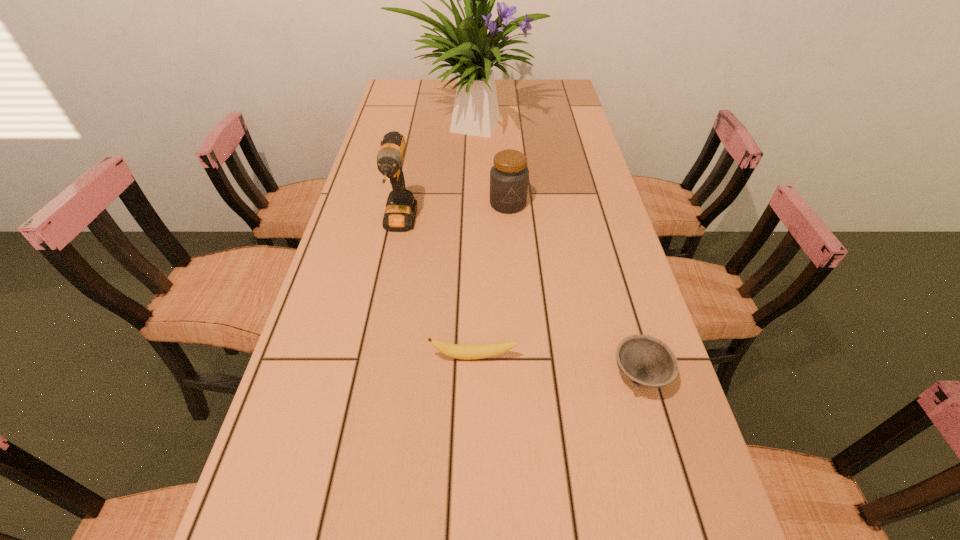
This screenshot has width=960, height=540. Identify the location of the tallest object. (471, 52).

Image resolution: width=960 pixels, height=540 pixels. I want to click on the farthest object, so (471, 52).

Find the location of a particular element. The height and width of the screenshot is (540, 960). drill is located at coordinates (401, 207).

Identify the location of the third shortest object. This screenshot has height=540, width=960. (509, 176).

Identify the location of banana. This screenshot has width=960, height=540. (466, 352).

You are a GUI agent. You are given a task and a screenshot of the screen. Output one action in this format:
    pyautogui.click(x=<x>, y=<y>)
    Task: Click on the rightmost object
    
    Given the screenshot: What is the action you would take?
    pyautogui.click(x=647, y=362)

I want to click on blank space located on the back of the farthest object, so click(471, 79).

Identify the location of vacant space located 0.260m with the drill bit of the drill facing forward. The height and width of the screenshot is (540, 960). (379, 329).

At what (x,y) coordinates should I click in order to perform the action: click on vacant space located on the surface of the jar near the warning symbol. Please return your answer as a coordinate pair (x, y). Image resolution: width=960 pixels, height=540 pixels. Looking at the image, I should click on (511, 236).

Where is `free region located on the upward curve of the banana`? The width and height of the screenshot is (960, 540). free region located on the upward curve of the banana is located at coordinates (473, 457).